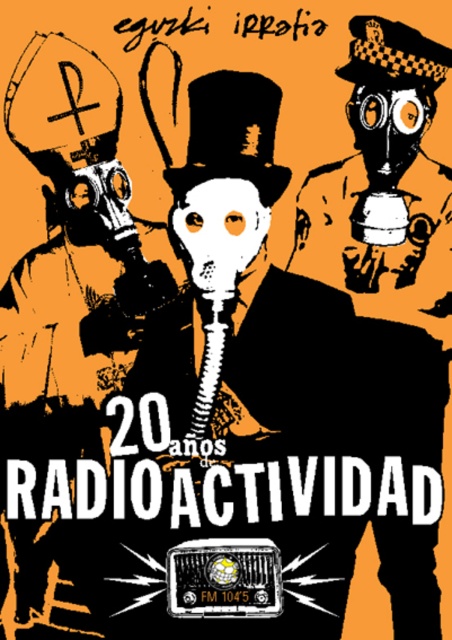
Can you confirm if matte black gas mask at left is smaller than black matte gas mask at right?

Actually, matte black gas mask at left might be larger than black matte gas mask at right.

In the scene shown: How much distance is there between matte black gas mask at left and black matte gas mask at right?

A distance of 23.21 inches exists between matte black gas mask at left and black matte gas mask at right.

Between point (53, 248) and point (395, 26), which one is positioned in front?

Positioned in front is point (395, 26).

Locate an element on the screen. matte black gas mask at left is located at coordinates (65, 320).